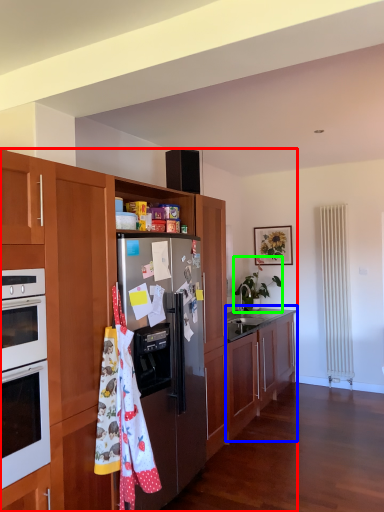
Question: Which object is the farthest from cabinetry (highlighted by a red box)? Choose among these: cabinetry (highlighted by a blue box) or houseplant (highlighted by a green box).

Choices:
 (A) cabinetry
 (B) houseplant

Answer: (B)